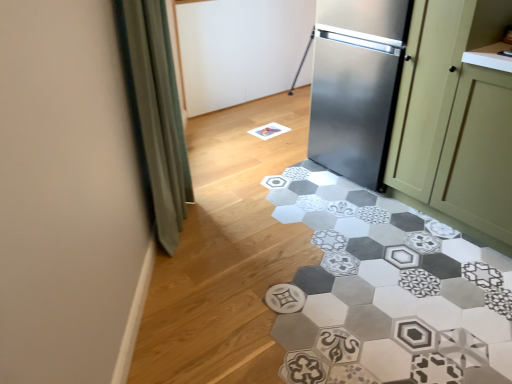
Image resolution: width=512 pixels, height=384 pixels. I want to click on free space that is in between green fabric curtain at left and green matte cabinet at right, so click(x=300, y=223).